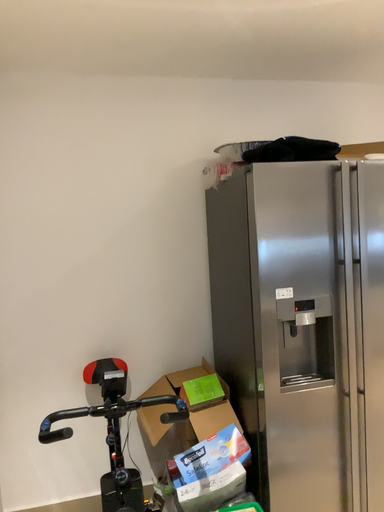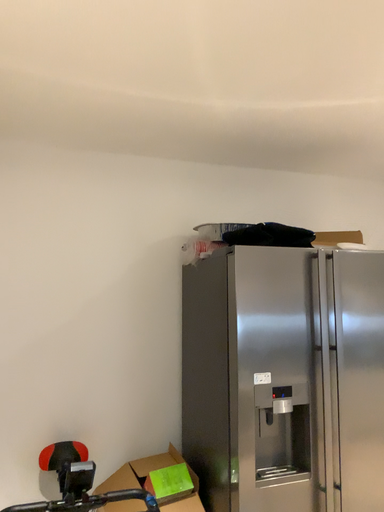
Question: How did the camera likely rotate when shooting the video?

Choices:
 (A) rotated downward
 (B) rotated upward

Answer: (B)